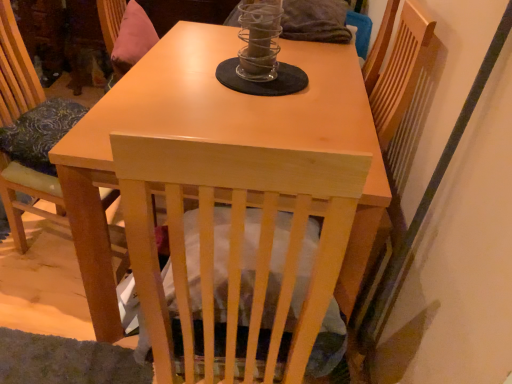
Question: Is point (18, 178) closer or farther from the camera than point (202, 34)?

Choices:
 (A) closer
 (B) farther

Answer: (A)

Question: From the image's perspective, is light wood chair at left located above or below light wood table at center?

Choices:
 (A) below
 (B) above

Answer: (B)

Question: Which is farther from the light wood table at center?

Choices:
 (A) light wood chair at left
 (B) clear glass candle holder at center

Answer: (A)

Question: Estimate the real-world distances between objects in this image. Which object is farther from the light wood table at center?

Choices:
 (A) light wood chair at left
 (B) clear glass candle holder at center

Answer: (A)